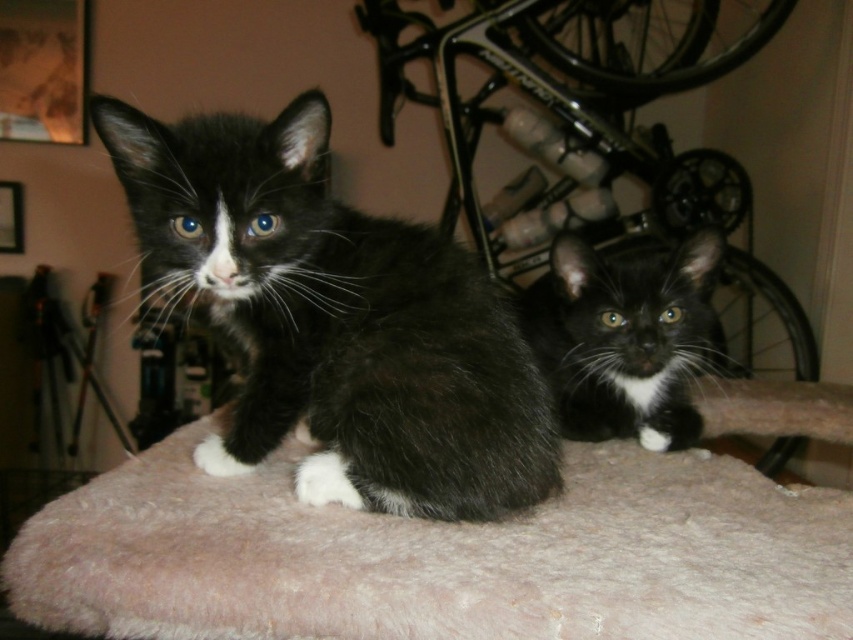
Question: Which is nearer to the black fur cat at center?

Choices:
 (A) black fuzzy cat at center
 (B) fuzzy pink cat bed at center

Answer: (B)

Question: Can you confirm if fuzzy pink cat bed at center is bigger than black fuzzy cat at center?

Choices:
 (A) no
 (B) yes

Answer: (B)

Question: Which object is the closest to the fuzzy pink cat bed at center?

Choices:
 (A) black fuzzy cat at center
 (B) black fur cat at center

Answer: (A)

Question: Among these points, which one is nearest to the camera?

Choices:
 (A) (253, 618)
 (B) (640, 358)

Answer: (A)

Question: From the image, what is the correct spatial relationship of fuzzy pink cat bed at center in relation to black fur cat at center?

Choices:
 (A) right
 (B) left

Answer: (B)

Question: Can you confirm if black fuzzy cat at center is wider than black fur cat at center?

Choices:
 (A) no
 (B) yes

Answer: (B)